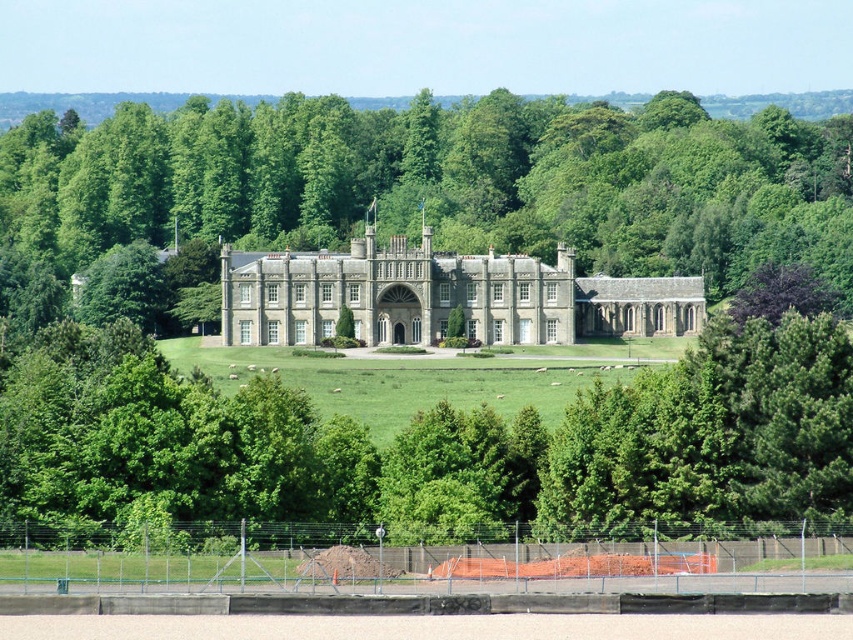
Between green leafy tree at center and gray stone palace at center, which one has more height?

green leafy tree at center

Describe the element at coordinates (444, 180) in the screenshot. I see `green leafy tree at center` at that location.

Locate an element on the screen. green leafy tree at center is located at coordinates (444, 180).